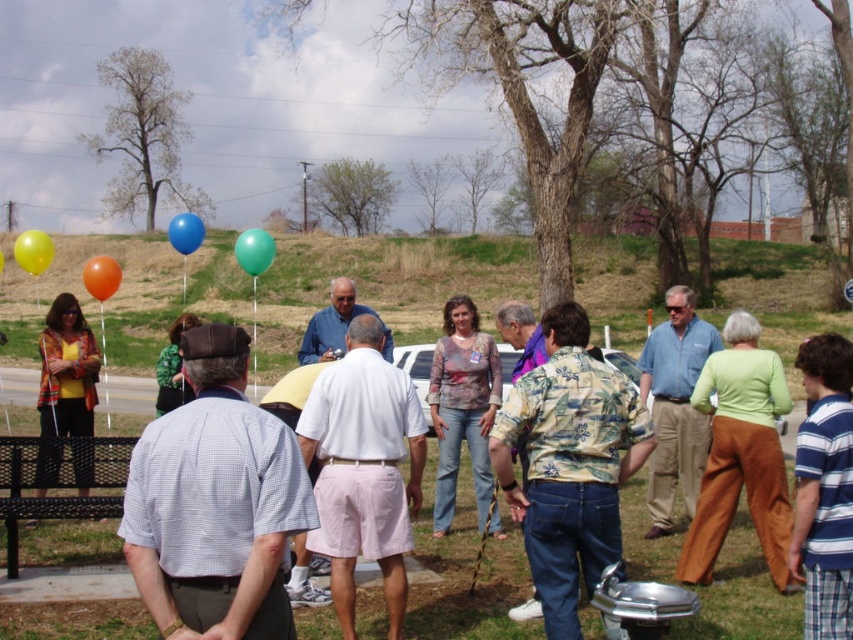
Question: Can you confirm if metallic silver grill at center is thinner than yellow matte balloon at upper left?

Choices:
 (A) yes
 (B) no

Answer: (B)

Question: Among these objects, which one is farthest from the camera?

Choices:
 (A) metallic silver grill at center
 (B) blue rubber balloon at upper left

Answer: (B)

Question: Which object is positioned closest to the yellow matte balloon at upper left?

Choices:
 (A) orange rubber balloon at left
 (B) blue rubber balloon at upper left
 (C) green rubber balloon at center
 (D) printed cotton shirt at left

Answer: (A)

Question: In this image, where is orange rubber balloon at left located relative to blue rubber balloon at upper left?

Choices:
 (A) left
 (B) right

Answer: (A)

Question: Considering the relative positions of matte yellow balloon at upper left and blue rubber balloon at upper left in the image provided, where is matte yellow balloon at upper left located with respect to blue rubber balloon at upper left?

Choices:
 (A) left
 (B) right

Answer: (A)

Question: Estimate the real-world distances between objects in this image. Which object is closer to the blue rubber balloon at upper left?

Choices:
 (A) green rubber balloon at center
 (B) printed cotton shirt at left
 (C) yellow matte balloon at upper left
 (D) metallic silver grill at center

Answer: (A)